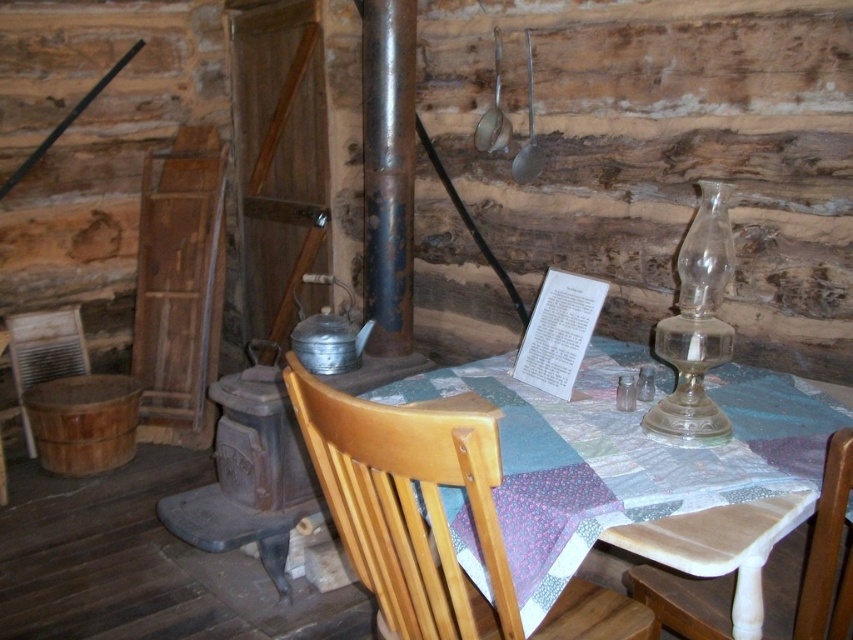
Can you confirm if quilted fabric table at center is taller than light brown wood chair at center?

Incorrect, quilted fabric table at center's height is not larger of light brown wood chair at center's.

Can you confirm if quilted fabric table at center is positioned to the left of light brown wood chair at center?

Correct, you'll find quilted fabric table at center to the left of light brown wood chair at center.

Does point (523, 538) lie behind point (846, 538)?

No, it is not.

Image resolution: width=853 pixels, height=640 pixels. I want to click on quilted fabric table at center, so click(x=633, y=461).

Who is more distant from viewer, (502, 506) or (473, 488)?

Positioned behind is point (502, 506).

Does quilted fabric table at center appear over wooden chair at center?

Correct, quilted fabric table at center is located above wooden chair at center.

Who is more forward, (807, 458) or (585, 592)?

Point (807, 458) is more forward.

Find the location of `quilted fabric table at center`. quilted fabric table at center is located at coordinates (633, 461).

Looking at this image, who is shorter, wooden chair at center or light brown wood chair at center?

Standing shorter between the two is light brown wood chair at center.

Which is below, wooden chair at center or light brown wood chair at center?

Positioned lower is light brown wood chair at center.

Find the location of `wooden chair at center`. wooden chair at center is located at coordinates (432, 516).

The image size is (853, 640). Find the location of `wooden chair at center`. wooden chair at center is located at coordinates (432, 516).